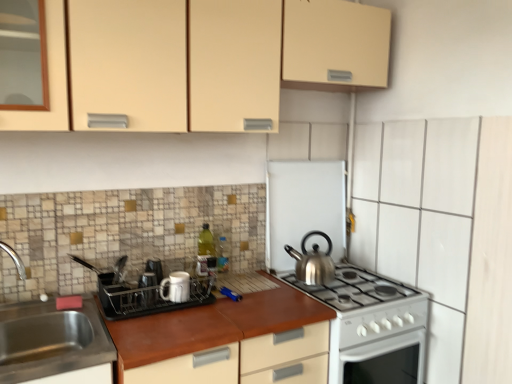
Question: Is white matte dish rack at center, which appears as the first appliance when viewed from the front, to the left or to the right of matte beige cabinet at upper center in the image?

Choices:
 (A) right
 (B) left

Answer: (B)

Question: Is point (210, 299) positioned closer to the camera than point (130, 71)?

Choices:
 (A) closer
 (B) farther

Answer: (B)

Question: Which is farther from the white ceramic mug at center, arranged as the second appliance when viewed from the left?

Choices:
 (A) matte beige cabinet at upper center
 (B) brown leather countertop at center
 (C) satin silver kettle at center, marked as the third appliance in a front-to-back arrangement
 (D) green glass bottle at center
 (E) silver metallic kettle at center-right

Answer: (A)

Question: Which object is the closest to the white ceramic mug at center, the 2th appliance positioned from the right?

Choices:
 (A) green glass bottle at center
 (B) stainless steel sink at lower left
 (C) brown leather countertop at center
 (D) matte beige cabinet at upper center
 (E) white matte dish rack at center, the 3th appliance in the back-to-front sequence

Answer: (E)